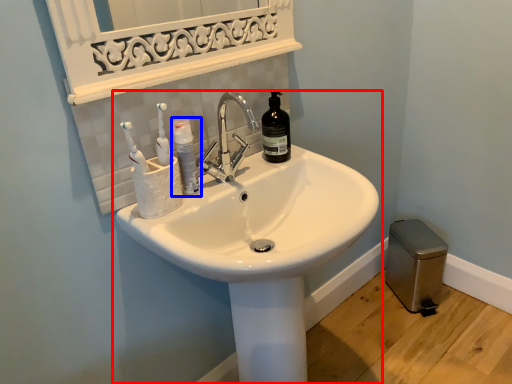
Question: Which object appears closest to the camera in this image, sink (highlighted by a red box) or mouthwash (highlighted by a blue box)?

Choices:
 (A) sink
 (B) mouthwash

Answer: (A)